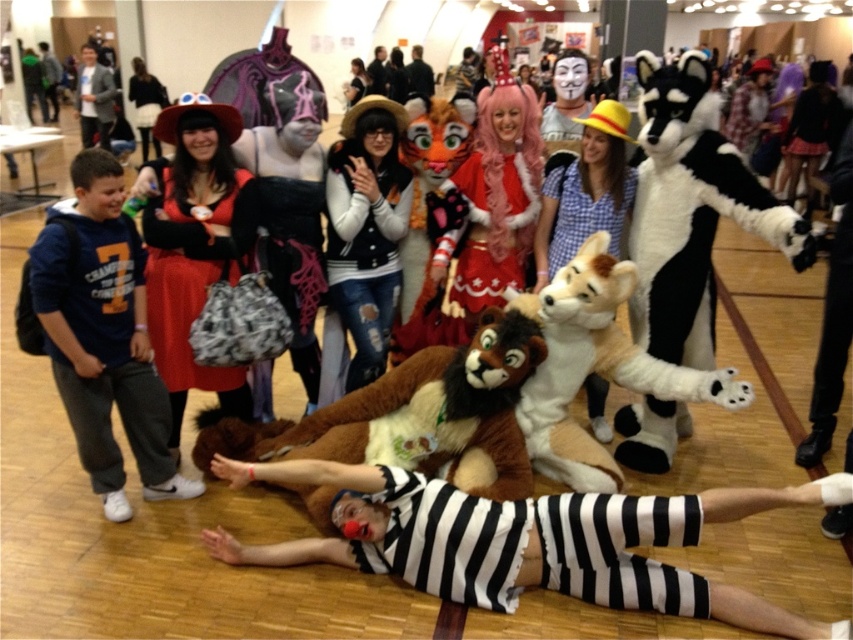
Does blue cotton hoodie at left appear over white fleece vest at center?

No, blue cotton hoodie at left is not above white fleece vest at center.

Between point (51, 364) and point (386, 177), which one is positioned behind?

Point (386, 177)

Who is more forward, (138, 324) or (386, 148)?

Positioned in front is point (138, 324).

Where is `blue cotton hoodie at left`? The width and height of the screenshot is (853, 640). blue cotton hoodie at left is located at coordinates (103, 336).

Measure the distance between black and white plush raccoon at center and camera.

black and white plush raccoon at center is 8.31 feet away from camera.

You are a GUI agent. You are given a task and a screenshot of the screen. Output one action in this format:
    pyautogui.click(x=<x>, y=<y>)
    Task: Click on the black and white plush raccoon at center
    This screenshot has height=640, width=853.
    Given the screenshot: What is the action you would take?
    pyautogui.click(x=692, y=211)

Does white striped fabric at center have a greater height compared to black and white striped outfit at center?

Yes, white striped fabric at center is taller than black and white striped outfit at center.

Between white striped fabric at center and black and white striped outfit at center, which one is positioned higher?

white striped fabric at center

Is point (798, 486) positioned behind point (553, 541)?

No, it is in front of (553, 541).

Locate an element on the screen. This screenshot has width=853, height=640. white striped fabric at center is located at coordinates (525, 540).